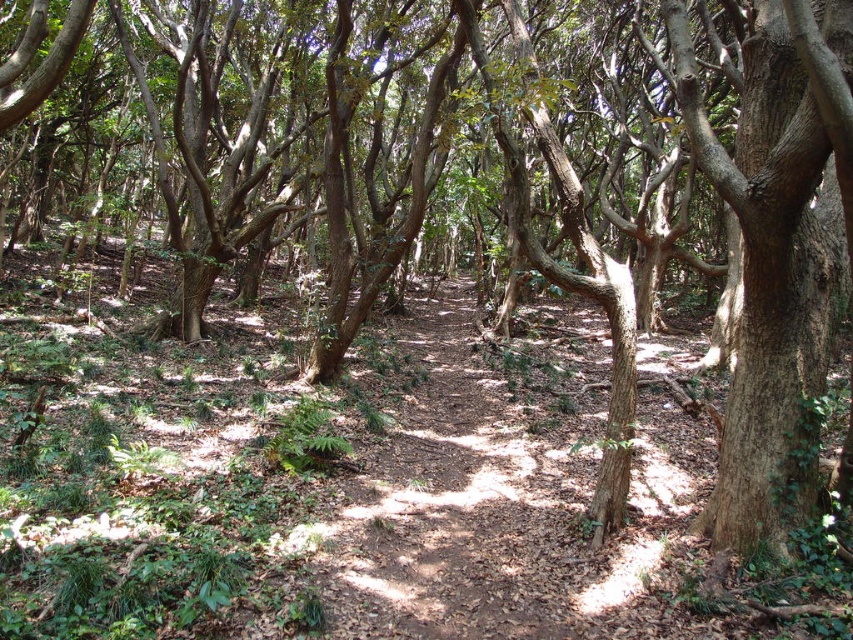
You are a hiker navigating a forest path and notice two landmarks marked by coordinates. The first is at point (x=683, y=492) and the second at point (x=785, y=390). Which point is closer to you as you stand on the path?

Point (x=683, y=492) is closer to you than point (x=785, y=390) because it is further to the viewer.

You are a hiker navigating through the forest and want to know if the brown dirt trail at center is higher or lower than the brown rough bark tree at right. Based on the scene, what can you determine?

The brown dirt trail at center has a lesser height compared to the brown rough bark tree at right, so the trail is lower than the tree.